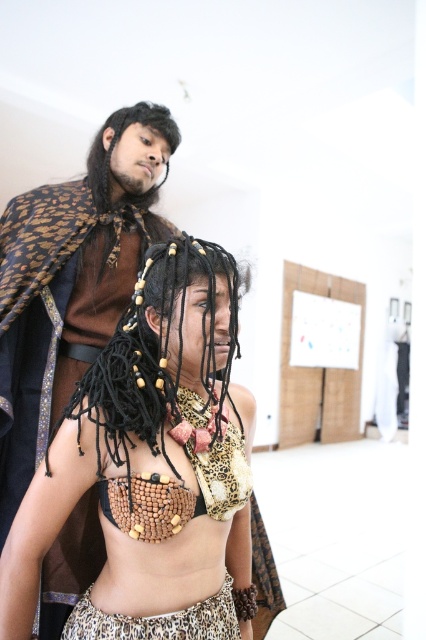
Question: Does wooden beads necklace at center lie behind black beaded hair at center?

Choices:
 (A) no
 (B) yes

Answer: (B)

Question: Which object appears farthest from the camera in this image?

Choices:
 (A) black beaded hair at center
 (B) wooden beads necklace at center

Answer: (B)

Question: Among these objects, which one is farthest from the camera?

Choices:
 (A) wooden beads necklace at center
 (B) black beaded hair at center

Answer: (A)

Question: Can you confirm if wooden beads necklace at center is thinner than black beaded hair at center?

Choices:
 (A) yes
 (B) no

Answer: (B)

Question: Can you confirm if wooden beads necklace at center is bigger than black beaded hair at center?

Choices:
 (A) no
 (B) yes

Answer: (B)